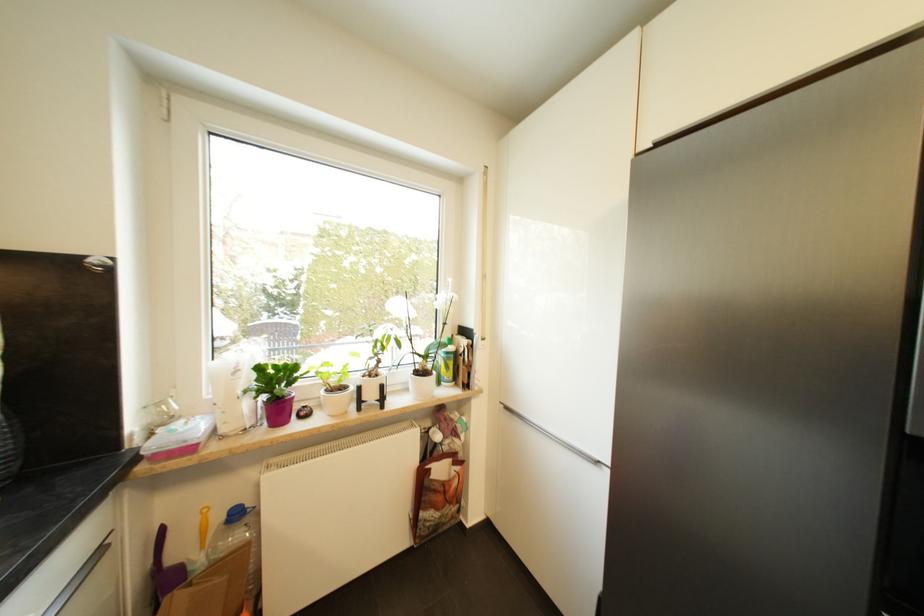
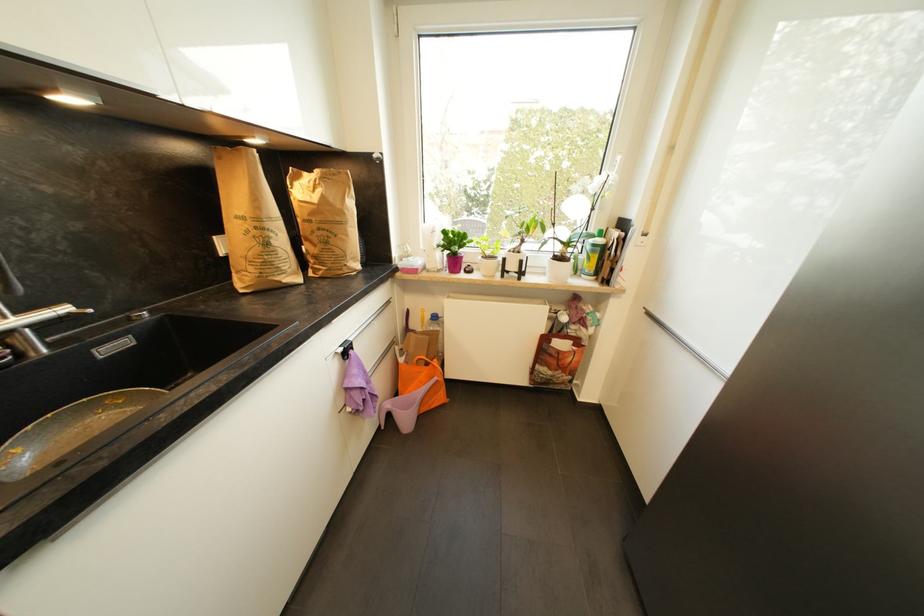
Find the pixel in the second image that matches [453,355] in the first image.

(599, 246)